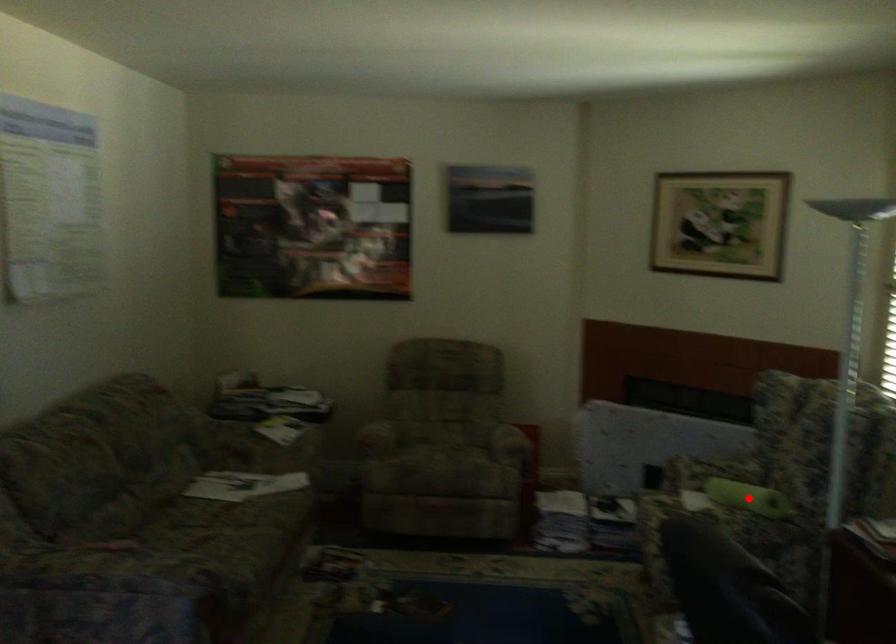
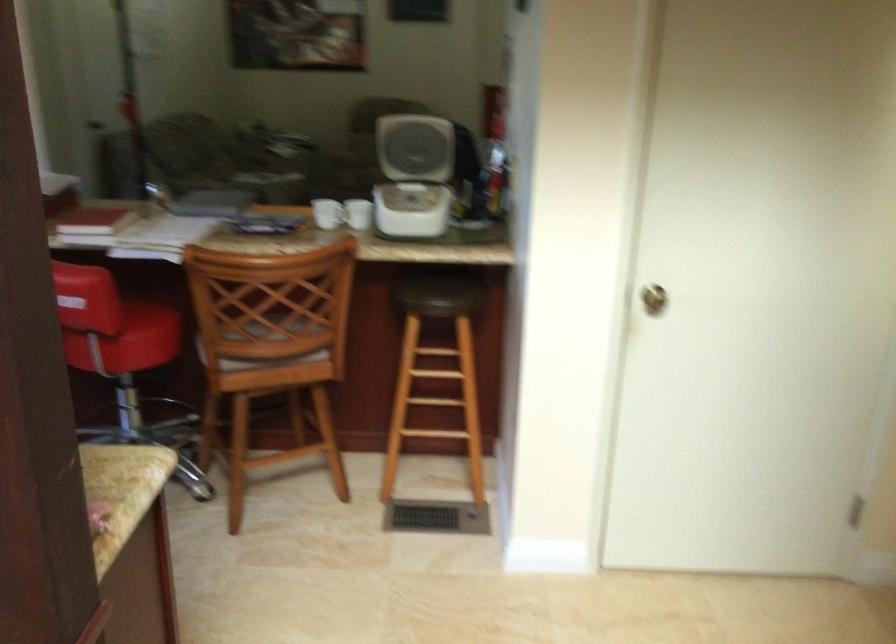
Question: I am providing you with two images of the same scene from different viewpoints. A red point is marked on the first image. At the location where the point appears in image 1, is it still visible in image 2?

Choices:
 (A) Yes
 (B) No

Answer: (B)